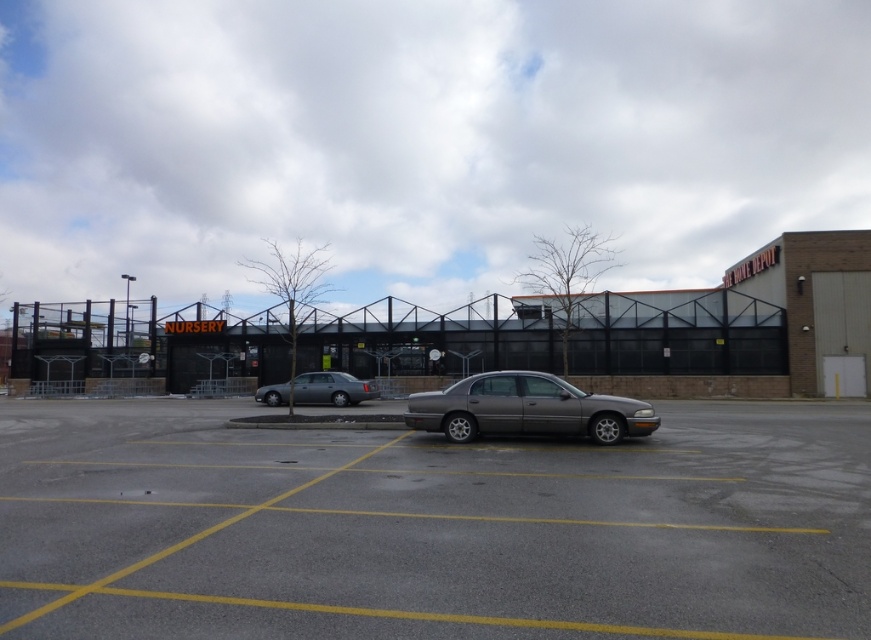
Question: Among these points, which one is farthest from the camera?

Choices:
 (A) (262, 396)
 (B) (500, 387)
 (C) (89, 582)

Answer: (A)

Question: Can you confirm if gray asphalt parking lot at center is positioned to the left of satin silver sedan at center?

Choices:
 (A) no
 (B) yes

Answer: (A)

Question: Observing the image, what is the correct spatial positioning of satin gray sedan at center in reference to satin silver sedan at center?

Choices:
 (A) below
 (B) above

Answer: (B)

Question: Which object is closer to the camera taking this photo?

Choices:
 (A) gray asphalt parking lot at center
 (B) satin silver sedan at center
 (C) satin gray sedan at center

Answer: (A)

Question: Can you confirm if satin gray sedan at center is smaller than satin silver sedan at center?

Choices:
 (A) no
 (B) yes

Answer: (B)

Question: Which of the following is the closest to the observer?

Choices:
 (A) (407, 424)
 (B) (345, 400)

Answer: (A)